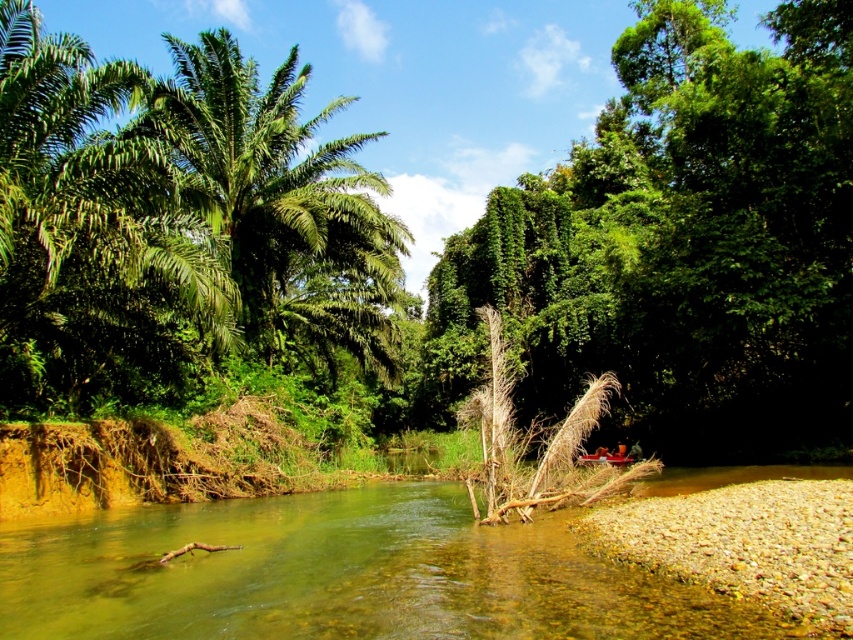
Who is shorter, green leafy tree at center or clear water at center?

clear water at center

Is green leafy tree at center to the left of clear water at center from the viewer's perspective?

Incorrect, green leafy tree at center is not on the left side of clear water at center.

Between point (808, 360) and point (0, 556), which one is positioned behind?

Positioned behind is point (808, 360).

You are a GUI agent. You are given a task and a screenshot of the screen. Output one action in this format:
    pyautogui.click(x=<x>, y=<y>)
    Task: Click on the green leafy tree at center
    The width and height of the screenshot is (853, 640).
    Given the screenshot: What is the action you would take?
    pyautogui.click(x=680, y=244)

Does green leafy tree at center appear on the right side of green leafy palm tree at upper left?

Indeed, green leafy tree at center is positioned on the right side of green leafy palm tree at upper left.

Is green leafy tree at center thinner than green leafy palm tree at upper left?

Incorrect, green leafy tree at center's width is not less than green leafy palm tree at upper left's.

Find the location of `green leafy tree at center`. green leafy tree at center is located at coordinates coord(680,244).

Can you confirm if clear water at center is positioned below green leafy palm tree at upper left?

Yes, clear water at center is below green leafy palm tree at upper left.

Who is higher up, clear water at center or green leafy palm tree at upper left?

green leafy palm tree at upper left is higher up.

You are a GUI agent. You are given a task and a screenshot of the screen. Output one action in this format:
    pyautogui.click(x=<x>, y=<y>)
    Task: Click on the clear water at center
    
    Given the screenshot: What is the action you would take?
    pyautogui.click(x=341, y=573)

The height and width of the screenshot is (640, 853). Find the location of `clear water at center`. clear water at center is located at coordinates (341, 573).